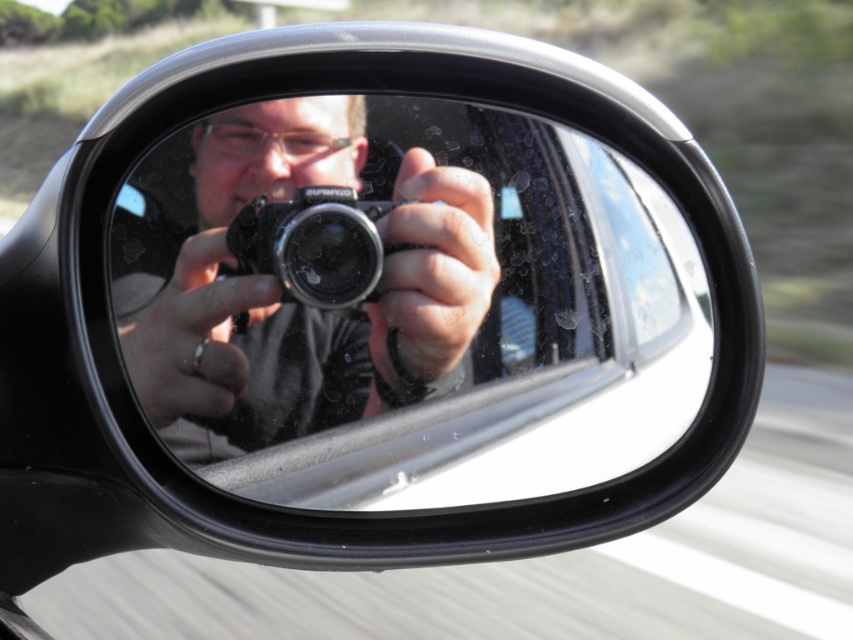
Which is below, matte black camera at center or black plastic camera at center?

matte black camera at center is lower down.

In order to click on matte black camera at center in this screenshot , I will do `click(300, 307)`.